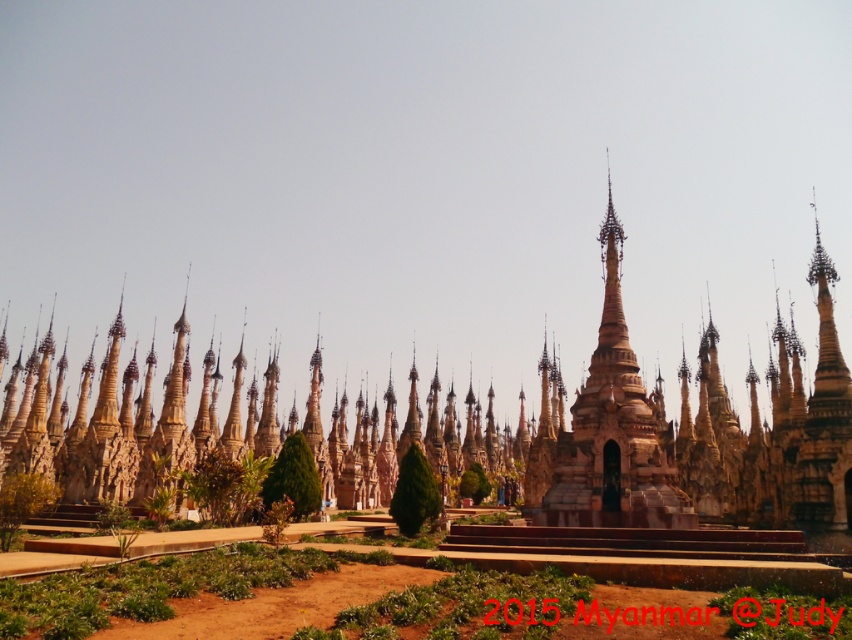
Question: Is brown stone pagoda at center to the left of golden polished stupa at center from the viewer's perspective?

Choices:
 (A) no
 (B) yes

Answer: (B)

Question: Among these points, which one is farthest from the camera?

Choices:
 (A) (602, 467)
 (B) (139, 497)

Answer: (B)

Question: Is brown stone pagoda at center bigger than golden polished stupa at center?

Choices:
 (A) no
 (B) yes

Answer: (B)

Question: Can you confirm if brown stone pagoda at center is smaller than golden polished stupa at center?

Choices:
 (A) yes
 (B) no

Answer: (B)

Question: Which of the following is the closest to the observer?

Choices:
 (A) golden polished stupa at center
 (B) brown stone pagoda at center

Answer: (B)

Question: Which point is closer to the camera taking this photo?

Choices:
 (A) (820, 458)
 (B) (609, 365)

Answer: (A)